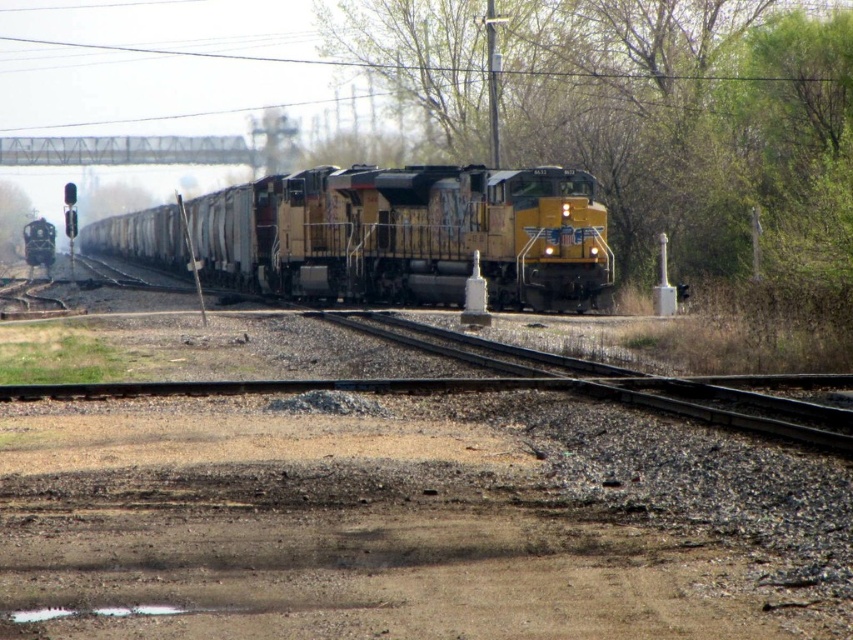
Who is more forward, (341,244) or (4,228)?

Point (341,244) is more forward.

This screenshot has height=640, width=853. What do you see at coordinates (410, 236) in the screenshot? I see `yellow weathered locomotive at center` at bounding box center [410, 236].

Is point (344, 252) positioned before point (10, 225)?

Yes, it is.

Identify the location of yellow weathered locomotive at center. (410, 236).

Who is taller, green leafy tree at center or yellow weathered locomotive at center?

green leafy tree at center is taller.

Does green leafy tree at center appear on the right side of yellow weathered locomotive at center?

Yes, green leafy tree at center is to the right of yellow weathered locomotive at center.

Is point (680, 83) less distant than point (432, 218)?

No, it is not.

Find the location of `green leafy tree at center`. green leafy tree at center is located at coordinates (641, 113).

Is green leafy tree at center thinner than green leafy tree at left?

Incorrect, green leafy tree at center's width is not less than green leafy tree at left's.

Is green leafy tree at center positioned behind green leafy tree at left?

No, green leafy tree at center is in front of green leafy tree at left.

What are the coordinates of `green leafy tree at center` in the screenshot? It's located at (641, 113).